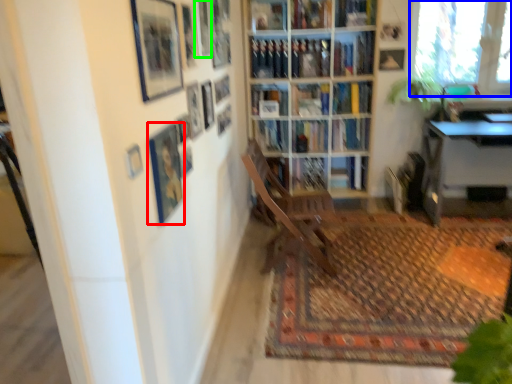
Question: Estimate the real-world distances between objects in this image. Which object is closer to picture frame (highlighted by a red box), window (highlighted by a blue box) or picture frame (highlighted by a green box)?

Choices:
 (A) window
 (B) picture frame

Answer: (B)